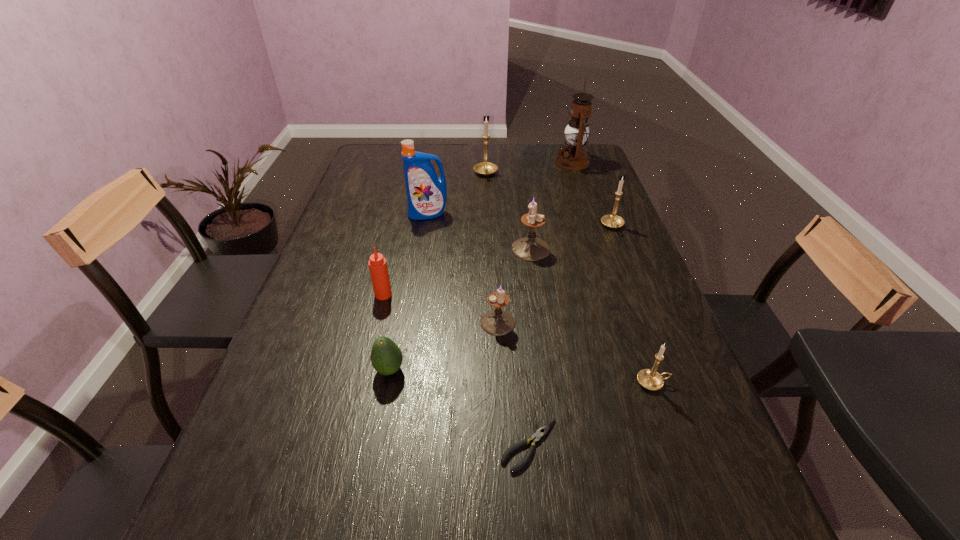
Image resolution: width=960 pixels, height=540 pixels. Find the location of `brown lantern`. brown lantern is located at coordinates (573, 157).

Where is `lantern`? The width and height of the screenshot is (960, 540). lantern is located at coordinates (573, 157).

At what (x,y) coordinates should I click in order to perform the action: click on the ninth shortest object. Please return your answer as a coordinate pair (x, y). Image resolution: width=960 pixels, height=540 pixels. Looking at the image, I should click on (426, 192).

Where is `the farthest candle holder`? The image size is (960, 540). the farthest candle holder is located at coordinates (485, 168).

Find the location of a particular element. The image size is (960, 540). the leftmost gold candle holder is located at coordinates (485, 168).

The height and width of the screenshot is (540, 960). In order to click on the third farthest candle holder in this screenshot , I will do `click(530, 248)`.

This screenshot has width=960, height=540. In order to click on the bigger purple candle holder in this screenshot , I will do `click(530, 248)`.

I want to click on the second nearest gold candle holder, so click(x=612, y=221).

At what (x,y) coordinates should I click in order to perform the action: click on the second smallest gold candle holder. Please return your answer as a coordinate pair (x, y). The height and width of the screenshot is (540, 960). Looking at the image, I should click on [x=612, y=221].

This screenshot has width=960, height=540. In order to click on Tabasco sauce in this screenshot , I will do `click(377, 264)`.